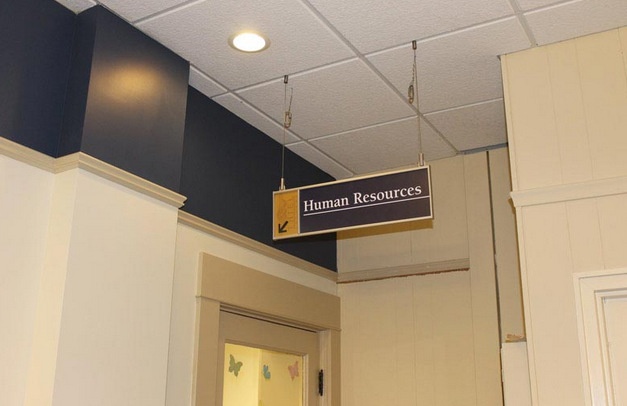
The width and height of the screenshot is (627, 406). In order to click on door in this screenshot , I will do `click(311, 347)`, `click(222, 365)`, `click(281, 387)`.